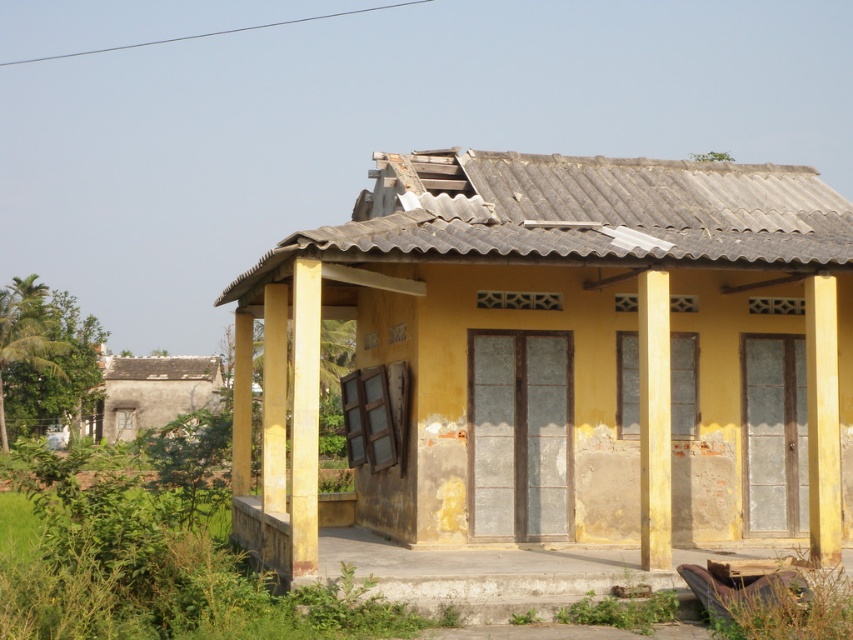
Question: Is yellow matte house at center below yellow painted wood porch at center?

Choices:
 (A) yes
 (B) no

Answer: (B)

Question: Can you confirm if yellow matte column at center is bigger than gray concrete hut at lower left?

Choices:
 (A) no
 (B) yes

Answer: (A)

Question: Considering the real-world distances, which object is farthest from the gray concrete hut at lower left?

Choices:
 (A) yellow matte/rough pillar at right
 (B) yellow painted wood porch at center
 (C) yellow matte wood pillar at center
 (D) yellow painted wood at center

Answer: (A)

Question: Which object is the farthest from the yellow matte/rough pillar at left?

Choices:
 (A) yellow matte/rough pillar at right
 (B) gray concrete hut at lower left
 (C) yellow matte house at center
 (D) yellow matte column at center

Answer: (B)

Question: Among these points, which one is farthest from the camera?

Choices:
 (A) (117, 422)
 (B) (653, 481)
 (C) (265, 397)

Answer: (A)

Question: Is yellow matte wood pillar at center smaller than yellow matte column at center?

Choices:
 (A) no
 (B) yes

Answer: (B)